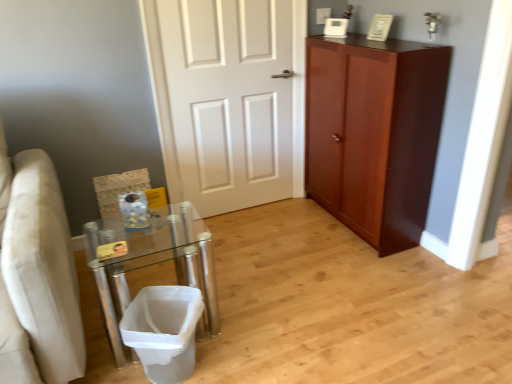
Question: From a real-world perspective, is white painted wood door at center positioned over white mesh laundry basket at lower left based on gravity?

Choices:
 (A) yes
 (B) no

Answer: (A)

Question: Is white painted wood door at center to the right of white mesh laundry basket at lower left from the viewer's perspective?

Choices:
 (A) no
 (B) yes

Answer: (B)

Question: Is white painted wood door at center oriented away from white mesh laundry basket at lower left?

Choices:
 (A) yes
 (B) no

Answer: (B)

Question: Is white painted wood door at center to the left of white mesh laundry basket at lower left from the viewer's perspective?

Choices:
 (A) yes
 (B) no

Answer: (B)

Question: Considering the relative sizes of white painted wood door at center and white mesh laundry basket at lower left in the image provided, is white painted wood door at center taller than white mesh laundry basket at lower left?

Choices:
 (A) yes
 (B) no

Answer: (A)

Question: Considering the positions of point (215, 183) and point (157, 294), is point (215, 183) closer or farther from the camera than point (157, 294)?

Choices:
 (A) closer
 (B) farther

Answer: (B)

Question: From the image's perspective, is white painted wood door at center located above or below white mesh laundry basket at lower left?

Choices:
 (A) above
 (B) below

Answer: (A)

Question: Is white painted wood door at center situated inside white mesh laundry basket at lower left or outside?

Choices:
 (A) inside
 (B) outside

Answer: (B)

Question: In the image, is white painted wood door at center positioned in front of or behind white mesh laundry basket at lower left?

Choices:
 (A) behind
 (B) front

Answer: (A)

Question: Is mahogany wood cabinet at right bigger or smaller than clear glass table at lower left?

Choices:
 (A) small
 (B) big

Answer: (B)

Question: Considering the positions of mahogany wood cabinet at right and clear glass table at lower left in the image, is mahogany wood cabinet at right taller or shorter than clear glass table at lower left?

Choices:
 (A) tall
 (B) short

Answer: (A)

Question: Considering the positions of point (439, 59) and point (174, 256), is point (439, 59) closer or farther from the camera than point (174, 256)?

Choices:
 (A) closer
 (B) farther

Answer: (A)

Question: Looking at their shapes, would you say mahogany wood cabinet at right is wider or thinner than clear glass table at lower left?

Choices:
 (A) thin
 (B) wide

Answer: (A)

Question: Considering the relative positions of clear glass table at lower left and mahogany wood cabinet at right in the image provided, is clear glass table at lower left to the left or to the right of mahogany wood cabinet at right?

Choices:
 (A) right
 (B) left

Answer: (B)

Question: Relative to mahogany wood cabinet at right, is clear glass table at lower left in front or behind?

Choices:
 (A) front
 (B) behind

Answer: (A)